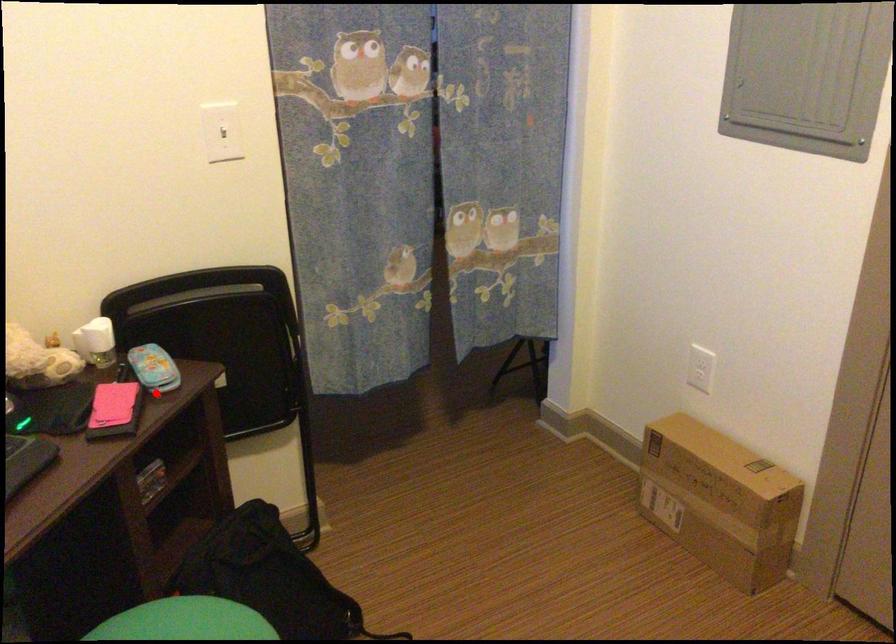
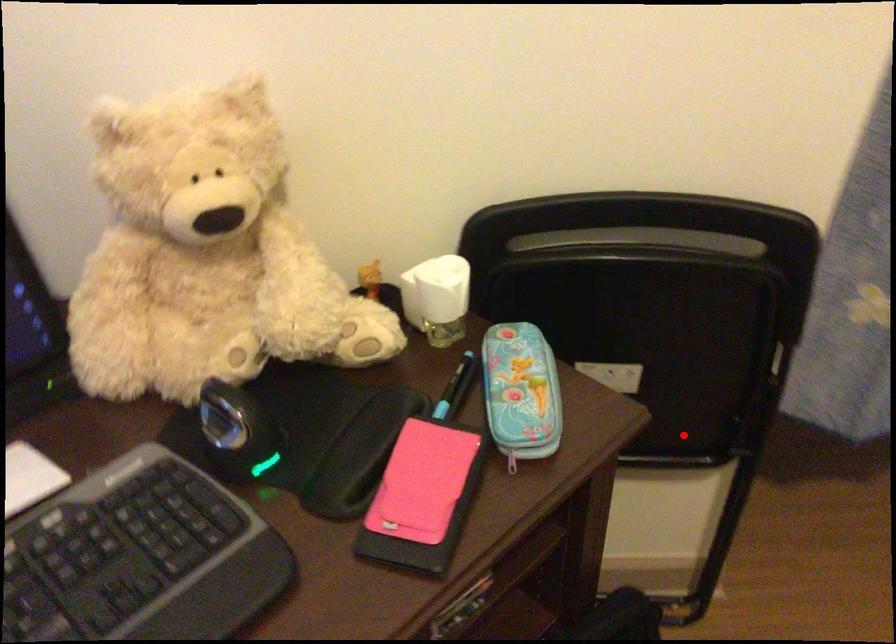
I am providing you with two images of the same scene from different viewpoints. A red point is marked on the first image and another point is marked on the second image. Is the red point in image1 aligned with the point shown in image2?

No